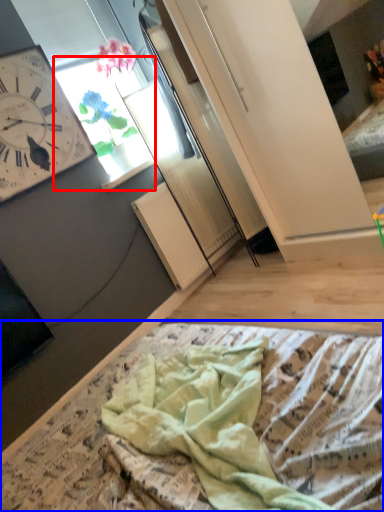
Question: Which of the following is the farthest to the observer, window (highlighted by a red box) or blanket (highlighted by a blue box)?

Choices:
 (A) window
 (B) blanket

Answer: (A)